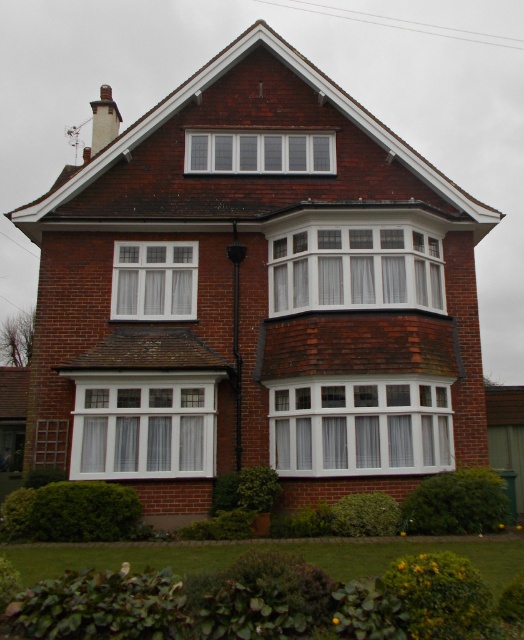
What do you see at coordinates (143, 428) in the screenshot? I see `white wood window at lower left` at bounding box center [143, 428].

Which is in front, point (158, 458) or point (328, 144)?

Point (158, 458) is in front.

Does point (129, 461) come closer to viewer compared to point (290, 164)?

That is True.

Image resolution: width=524 pixels, height=640 pixels. What are the coordinates of `white wood window at lower left` in the screenshot? It's located at (143, 428).

Can you confirm if white textured bay window at center is wider than white glass window at upper center?

No.

Is point (316, 284) closer to camera compared to point (214, 145)?

That is True.

Image resolution: width=524 pixels, height=640 pixels. In order to click on white textured bay window at center in this screenshot , I will do `click(354, 268)`.

Is white wood window at center below white textured bay window at center?

Correct, white wood window at center is located below white textured bay window at center.

What do you see at coordinates (359, 426) in the screenshot?
I see `white wood window at center` at bounding box center [359, 426].

Locate an element on the screen. The width and height of the screenshot is (524, 640). white wood window at center is located at coordinates (359, 426).

This screenshot has width=524, height=640. Find the location of `white wood window at center`. white wood window at center is located at coordinates (359, 426).